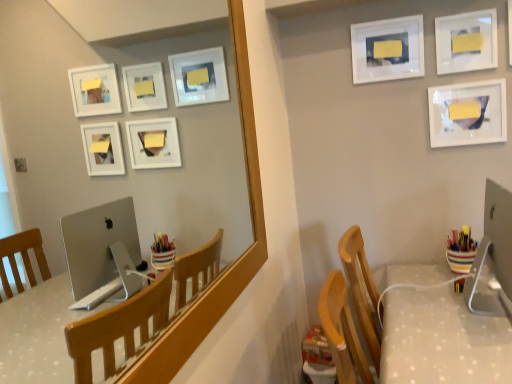
Identify the location of sleek silver monitor at right. (493, 246).

The width and height of the screenshot is (512, 384). What do you see at coordinates (388, 49) in the screenshot?
I see `white matte picture frame at upper center, marked as the 3th picture frame in a right-to-left arrangement` at bounding box center [388, 49].

What is the approximate height of white glossy picture frame at upper right, acting as the 3th picture frame starting from the left?

white glossy picture frame at upper right, acting as the 3th picture frame starting from the left, is 11.53 inches tall.

This screenshot has height=384, width=512. What do you see at coordinates (121, 136) in the screenshot?
I see `matte wooden mirror at upper center` at bounding box center [121, 136].

Where is `multicolored plastic cup at right`? multicolored plastic cup at right is located at coordinates (461, 250).

Is white glossy picture frame at upper right, the 2th picture frame from the left, further to the viewer compared to multicolored plastic cup at right?

Yes, it is behind multicolored plastic cup at right.

How much distance is there between white glossy picture frame at upper right, the 2th picture frame from the left, and multicolored plastic cup at right?

white glossy picture frame at upper right, the 2th picture frame from the left, and multicolored plastic cup at right are 84.94 centimeters apart.

From the image's perspective, is white glossy picture frame at upper right, the 2th picture frame from the left, on multicolored plastic cup at right?

Yes, from the image's perspective, white glossy picture frame at upper right, the 2th picture frame from the left, is on top of multicolored plastic cup at right.

Does white glossy picture frame at upper right, acting as the second picture frame starting from the right, have a smaller size compared to multicolored plastic cup at right?

Yes.

Is sleek silver monitor at right oriented towards white matte picture frame at upper center, placed as the first picture frame when sorted from left to right?

No, sleek silver monitor at right is not facing towards white matte picture frame at upper center, placed as the first picture frame when sorted from left to right.

Can you confirm if sleek silver monitor at right is bigger than white matte picture frame at upper center, placed as the first picture frame when sorted from left to right?

Yes.

Is white matte picture frame at upper center, marked as the 3th picture frame in a right-to-left arrangement, surrounded by sleek silver monitor at right?

No, white matte picture frame at upper center, marked as the 3th picture frame in a right-to-left arrangement, is located outside of sleek silver monitor at right.

Is sleek silver monitor at right inside the boundaries of multicolored plastic cup at right, or outside?

sleek silver monitor at right is not enclosed by multicolored plastic cup at right.

Does point (507, 275) appear closer or farther from the camera than point (467, 252)?

Point (507, 275) appears to be closer to the viewer than point (467, 252).

Considering the relative positions of sleek silver monitor at right and multicolored plastic cup at right in the image provided, is sleek silver monitor at right to the right of multicolored plastic cup at right from the viewer's perspective?

No.

Which object is thinner, sleek silver monitor at right or multicolored plastic cup at right?

multicolored plastic cup at right.

Between sleek silver monitor at right and white glossy picture frame at upper right, acting as the 3th picture frame starting from the left, which one has smaller size?

white glossy picture frame at upper right, acting as the 3th picture frame starting from the left, is smaller.

Where is `the 2nd picture frame counting from the right of the sleek silver monitor at right`? The width and height of the screenshot is (512, 384). the 2nd picture frame counting from the right of the sleek silver monitor at right is located at coordinates (468, 113).

In terms of width, does sleek silver monitor at right look wider or thinner when compared to white glossy picture frame at upper right, acting as the 3th picture frame starting from the left?

sleek silver monitor at right is wider than white glossy picture frame at upper right, acting as the 3th picture frame starting from the left.

Is multicolored plastic cup at right positioned far away from matte wooden mirror at upper center?

Yes.

Is point (466, 265) closer or farther from the camera than point (54, 123)?

Point (466, 265) is positioned closer to the camera compared to point (54, 123).

Considering the sizes of objects multicolored plastic cup at right and matte wooden mirror at upper center in the image provided, who is thinner, multicolored plastic cup at right or matte wooden mirror at upper center?

matte wooden mirror at upper center.

In terms of width, does white glossy picture frame at upper right, acting as the second picture frame starting from the right, look wider or thinner when compared to matte wooden mirror at upper center?

Clearly, white glossy picture frame at upper right, acting as the second picture frame starting from the right, has less width compared to matte wooden mirror at upper center.

At what (x,y) coordinates should I click in order to perform the action: click on picture frame that is the 3rd one when counting upward from the matte wooden mirror at upper center (from the image's perspective). Please return your answer as a coordinate pair (x, y). Looking at the image, I should click on (466, 42).

Does white glossy picture frame at upper right, the 2th picture frame from the left, appear on the right side of matte wooden mirror at upper center?

Correct, you'll find white glossy picture frame at upper right, the 2th picture frame from the left, to the right of matte wooden mirror at upper center.

Find the location of a particular element. mirror in front of the white dotted fabric table at lower right is located at coordinates (121, 136).

Considering the relative sizes of matte wooden mirror at upper center and white dotted fabric table at lower right in the image provided, is matte wooden mirror at upper center wider than white dotted fabric table at lower right?

No, matte wooden mirror at upper center is not wider than white dotted fabric table at lower right.

Could you tell me if matte wooden mirror at upper center is facing white dotted fabric table at lower right?

No, matte wooden mirror at upper center is not oriented towards white dotted fabric table at lower right.

Where is `the 1st picture frame behind the multicolored plastic cup at right`? The image size is (512, 384). the 1st picture frame behind the multicolored plastic cup at right is located at coordinates (466, 42).

This screenshot has height=384, width=512. I want to click on desktop computer in front of the white matte picture frame at upper center, marked as the 3th picture frame in a right-to-left arrangement, so click(x=493, y=246).

Considering their positions, is white matte picture frame at upper center, placed as the first picture frame when sorted from left to right, positioned closer to white glossy picture frame at upper right, acting as the 3th picture frame starting from the left, than sleek silver monitor at right?

white matte picture frame at upper center, placed as the first picture frame when sorted from left to right.

Looking at the image, which one is located closer to white glossy picture frame at upper right, the 2th picture frame from the left, white dotted fabric table at lower right or white glossy picture frame at upper right, which is the 1th picture frame from right to left?

The object closer to white glossy picture frame at upper right, the 2th picture frame from the left, is white glossy picture frame at upper right, which is the 1th picture frame from right to left.

When comparing their distances from white glossy picture frame at upper right, acting as the second picture frame starting from the right, does multicolored plastic cup at right or white matte picture frame at upper center, marked as the 3th picture frame in a right-to-left arrangement, seem further?

The object further to white glossy picture frame at upper right, acting as the second picture frame starting from the right, is multicolored plastic cup at right.

Based on their spatial positions, is white glossy picture frame at upper right, which is the 1th picture frame from right to left, or sleek silver monitor at right closer to white matte picture frame at upper center, marked as the 3th picture frame in a right-to-left arrangement?

The object closer to white matte picture frame at upper center, marked as the 3th picture frame in a right-to-left arrangement, is white glossy picture frame at upper right, which is the 1th picture frame from right to left.

Which object lies further to the anchor point matte wooden mirror at upper center, multicolored plastic cup at right or white dotted fabric table at lower right?

Based on the image, multicolored plastic cup at right appears to be further to matte wooden mirror at upper center.

From the image, which object appears to be farther from white dotted fabric table at lower right, matte wooden mirror at upper center or white glossy picture frame at upper right, acting as the second picture frame starting from the right?

matte wooden mirror at upper center lies further to white dotted fabric table at lower right than the other object.

From the image, which object appears to be farther from white glossy picture frame at upper right, acting as the second picture frame starting from the right, white glossy picture frame at upper right, acting as the 3th picture frame starting from the left, or matte wooden mirror at upper center?

matte wooden mirror at upper center is positioned further to the anchor white glossy picture frame at upper right, acting as the second picture frame starting from the right.

Considering their positions, is white glossy picture frame at upper right, which is the 1th picture frame from right to left, positioned further to multicolored plastic cup at right than matte wooden mirror at upper center?

matte wooden mirror at upper center is positioned further to the anchor multicolored plastic cup at right.

At what (x,y) coordinates should I click in order to perform the action: click on stationery between matte wooden mirror at upper center and white glossy picture frame at upper right, acting as the second picture frame starting from the right, along the z-axis. Please return your answer as a coordinate pair (x, y). The width and height of the screenshot is (512, 384). Looking at the image, I should click on (461, 250).

Where is `desktop computer positioned between white dotted fabric table at lower right and multicolored plastic cup at right from near to far`? This screenshot has width=512, height=384. desktop computer positioned between white dotted fabric table at lower right and multicolored plastic cup at right from near to far is located at coordinates (493, 246).

Where is `table between matte wooden mirror at upper center and multicolored plastic cup at right in the front-back direction`? The image size is (512, 384). table between matte wooden mirror at upper center and multicolored plastic cup at right in the front-back direction is located at coordinates (442, 340).

You are a GUI agent. You are given a task and a screenshot of the screen. Output one action in this format:
    pyautogui.click(x=<x>, y=<y>)
    Task: Click on the picture frame between matte wooden mirror at upper center and white glossy picture frame at upper right, acting as the 3th picture frame starting from the left, from front to back
    This screenshot has height=384, width=512.
    Given the screenshot: What is the action you would take?
    pyautogui.click(x=466, y=42)